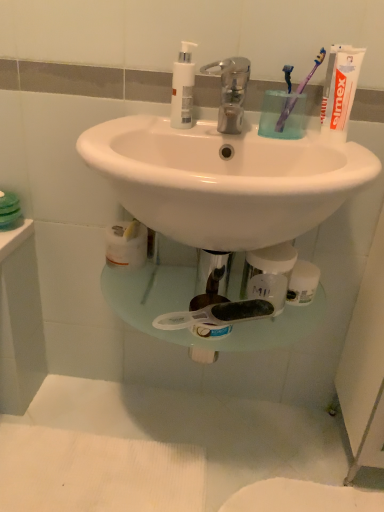
Question: Does white matte toothpaste at upper right have a larger size compared to purple plastic toothbrush at upper right, placed as the 1th toothbrush when sorted from left to right?

Choices:
 (A) no
 (B) yes

Answer: (B)

Question: Is white matte toothpaste at upper right to the right of purple plastic toothbrush at upper right, positioned as the second toothbrush in right-to-left order, from the viewer's perspective?

Choices:
 (A) yes
 (B) no

Answer: (A)

Question: From the image's perspective, would you say white matte toothpaste at upper right is shown under purple plastic toothbrush at upper right, positioned as the second toothbrush in right-to-left order?

Choices:
 (A) no
 (B) yes

Answer: (B)

Question: From a real-world perspective, is white matte toothpaste at upper right on top of purple plastic toothbrush at upper right, positioned as the second toothbrush in right-to-left order?

Choices:
 (A) no
 (B) yes

Answer: (B)

Question: From a real-world perspective, is white matte toothpaste at upper right under purple plastic toothbrush at upper right, positioned as the second toothbrush in right-to-left order?

Choices:
 (A) no
 (B) yes

Answer: (A)

Question: Visually, is metallic faucet at center positioned to the left or to the right of white matte toothpaste at upper right?

Choices:
 (A) left
 (B) right

Answer: (A)

Question: From a real-world perspective, is metallic faucet at center positioned above or below white matte toothpaste at upper right?

Choices:
 (A) below
 (B) above

Answer: (A)

Question: Looking at their shapes, would you say metallic faucet at center is wider or thinner than white matte toothpaste at upper right?

Choices:
 (A) wide
 (B) thin

Answer: (A)

Question: Is metallic faucet at center in front of or behind white matte toothpaste at upper right in the image?

Choices:
 (A) behind
 (B) front

Answer: (B)

Question: Choose the correct answer: Is white matte toothpaste at upper right inside white plastic pump bottle at upper center or outside it?

Choices:
 (A) inside
 (B) outside

Answer: (B)

Question: From a real-world perspective, is white matte toothpaste at upper right positioned above or below white plastic pump bottle at upper center?

Choices:
 (A) above
 (B) below

Answer: (A)

Question: Considering the positions of white matte toothpaste at upper right and white plastic pump bottle at upper center in the image, is white matte toothpaste at upper right taller or shorter than white plastic pump bottle at upper center?

Choices:
 (A) tall
 (B) short

Answer: (A)

Question: Based on their positions, is white matte toothpaste at upper right located to the left or right of white plastic pump bottle at upper center?

Choices:
 (A) left
 (B) right

Answer: (B)

Question: Would you say metallic faucet at center is inside or outside white plastic pump bottle at upper center?

Choices:
 (A) outside
 (B) inside

Answer: (A)

Question: Based on their sizes in the image, would you say metallic faucet at center is bigger or smaller than white plastic pump bottle at upper center?

Choices:
 (A) big
 (B) small

Answer: (A)